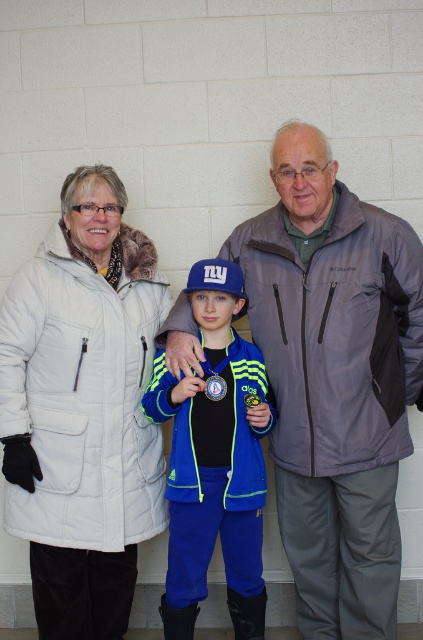
Question: Observing the image, what is the correct spatial positioning of white puffy coat at left in reference to gold metallic medal at center?

Choices:
 (A) below
 (B) above

Answer: (A)

Question: Does white puffy coat at left have a lesser width compared to gold metallic medal at center?

Choices:
 (A) yes
 (B) no

Answer: (B)

Question: Which object is positioned farthest from the white puffy coat at left?

Choices:
 (A) gold metallic medal at center
 (B) gray softshell jacket at center

Answer: (A)

Question: Observing the image, what is the correct spatial positioning of gray softshell jacket at center in reference to gold metallic medal at center?

Choices:
 (A) below
 (B) above

Answer: (A)

Question: Which object appears closest to the camera in this image?

Choices:
 (A) white puffy coat at left
 (B) blue fleece jacket at center
 (C) gray softshell jacket at center
 (D) gold metallic medal at center

Answer: (A)

Question: Which object appears farthest from the camera in this image?

Choices:
 (A) gray softshell jacket at center
 (B) gold metallic medal at center

Answer: (B)